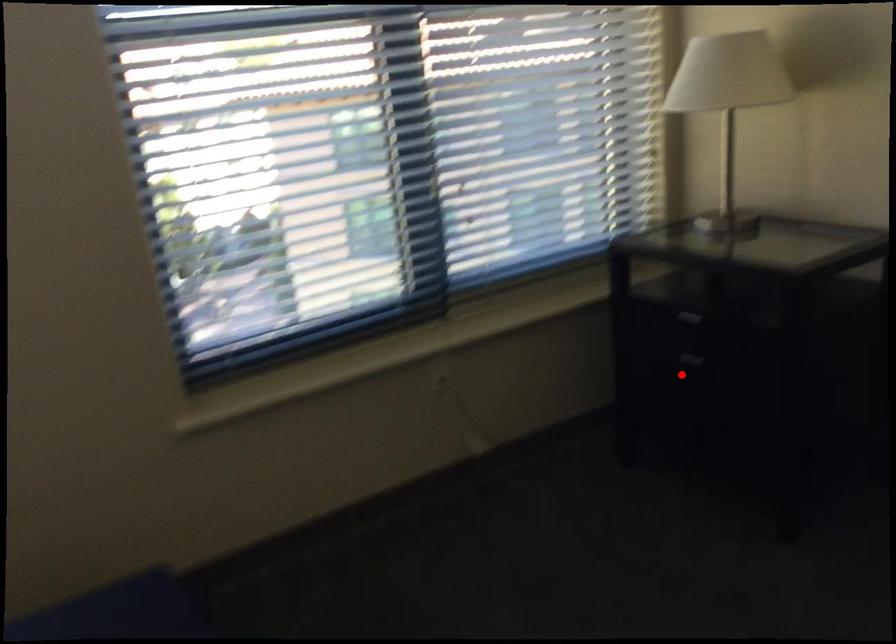
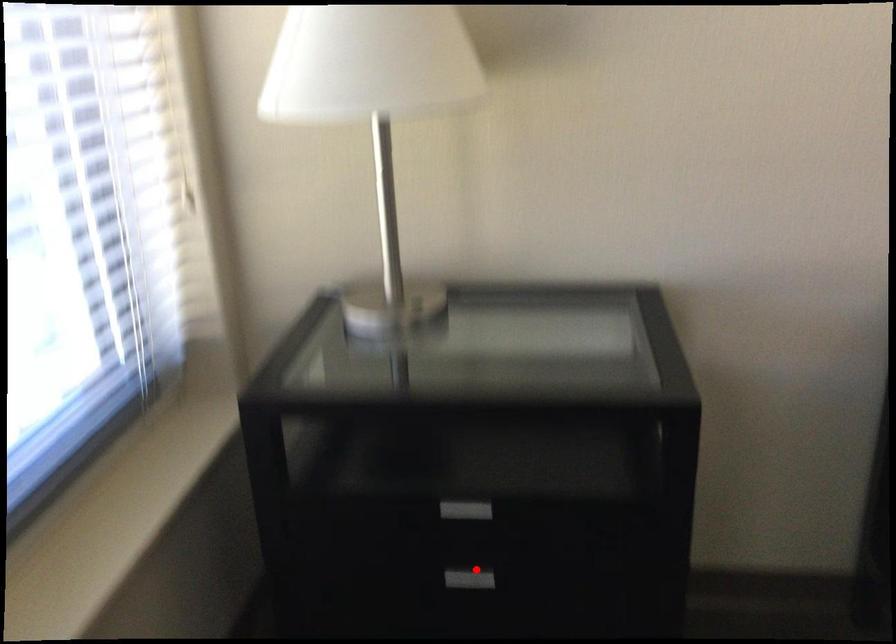
I am providing you with two images of the same scene from different viewpoints. A red point is marked on the first image and another point is marked on the second image. Is the marked point in image1 the same physical position as the marked point in image2?

Yes